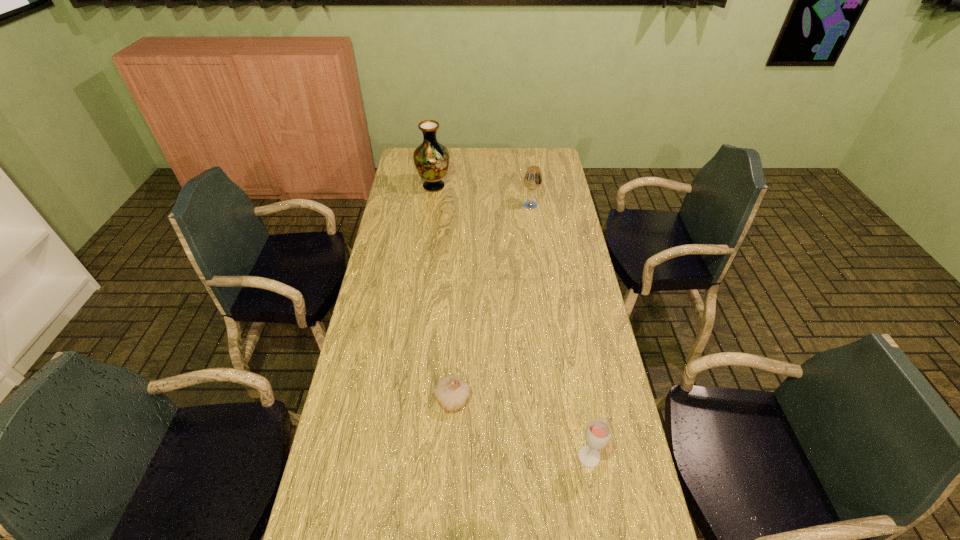
In order to click on free space between the garlic and the third tallest object in this screenshot , I will do `click(520, 428)`.

This screenshot has height=540, width=960. I want to click on object that is the second closest to the shorter wineglass, so click(x=532, y=180).

Select which object appears as the second closest to the tallest object. Please provide its 2D coordinates. Your answer should be formatted as a tuple, i.e. [(x, y)], where the tuple contains the x and y coordinates of a point satisfying the conditions above.

[(451, 392)]